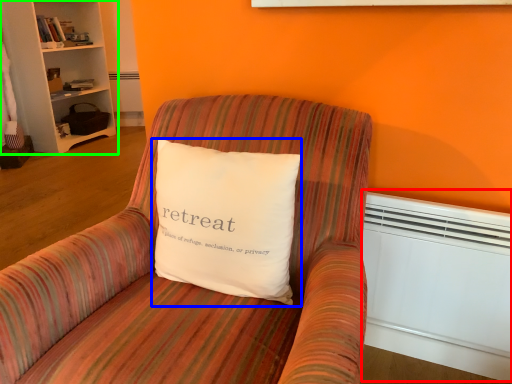
Question: Which is nearer to the heater (highlighted by a red box)? pillow (highlighted by a blue box) or bookcase (highlighted by a green box).

Choices:
 (A) pillow
 (B) bookcase

Answer: (A)